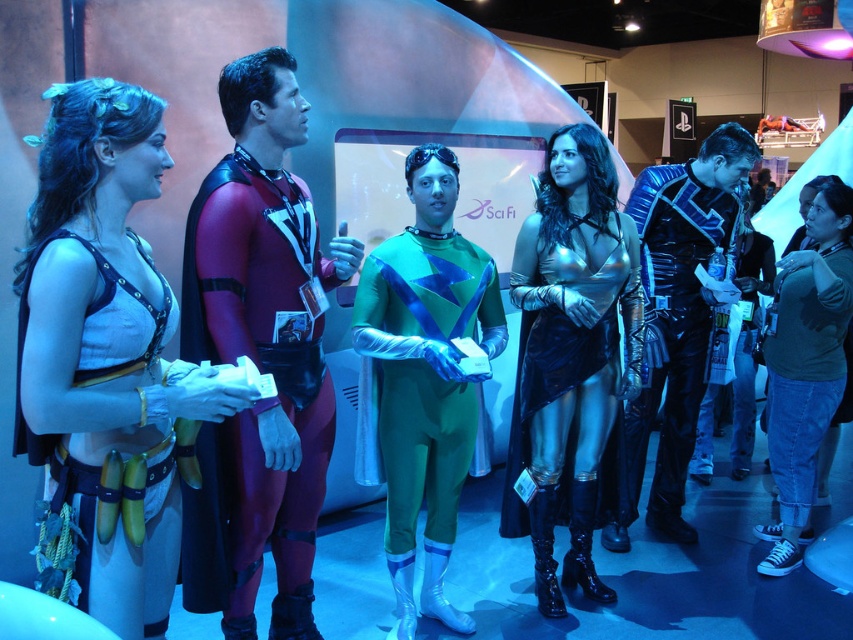
Question: Is maroon spandex suit at center in front of green metallic suit at center?

Choices:
 (A) no
 (B) yes

Answer: (B)

Question: Is metallic blue armor at right positioned behind green cotton shirt at lower right?

Choices:
 (A) yes
 (B) no

Answer: (B)

Question: Estimate the real-world distances between objects in this image. Which object is closer to the metallic gold dress at center?

Choices:
 (A) maroon spandex suit at center
 (B) green metallic suit at center
 (C) green cotton shirt at lower right

Answer: (B)

Question: Considering the real-world distances, which object is closest to the metallic blue armor at right?

Choices:
 (A) green metallic suit at center
 (B) matte white costume at center
 (C) green cotton shirt at lower right
 (D) maroon spandex suit at center

Answer: (C)

Question: Can you confirm if maroon spandex suit at center is positioned to the left of green cotton shirt at lower right?

Choices:
 (A) yes
 (B) no

Answer: (A)

Question: Considering the real-world distances, which object is closest to the matte white costume at center?

Choices:
 (A) green metallic suit at center
 (B) maroon spandex suit at center
 (C) metallic blue armor at right
 (D) metallic gold dress at center

Answer: (B)